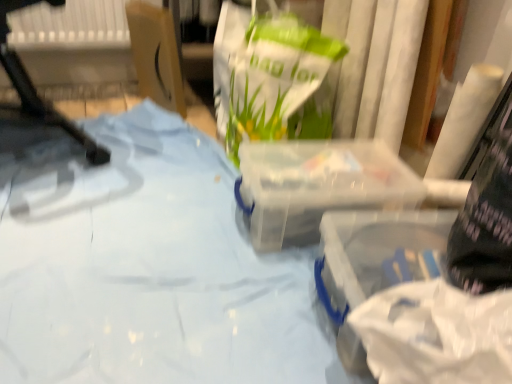
Question: In terms of width, does cardboard box at upper left look wider or thinner when compared to blue fabric at center?

Choices:
 (A) wide
 (B) thin

Answer: (B)

Question: Is cardboard box at upper left bigger or smaller than blue fabric at center?

Choices:
 (A) big
 (B) small

Answer: (B)

Question: Estimate the real-world distances between objects in this image. Which object is farther from the transparent plastic container at center, which is the first box in back-to-front order?

Choices:
 (A) blue fabric at center
 (B) cardboard box at upper left
 (C) white plastic chair at left
 (D) transparent plastic container at lower right, marked as the second box in a back-to-front arrangement

Answer: (C)

Question: Which object is positioned closest to the transparent plastic container at center, which is the first box in back-to-front order?

Choices:
 (A) cardboard box at upper left
 (B) white plastic chair at left
 (C) transparent plastic container at lower right, which is counted as the first box, starting from the front
 (D) blue fabric at center

Answer: (C)